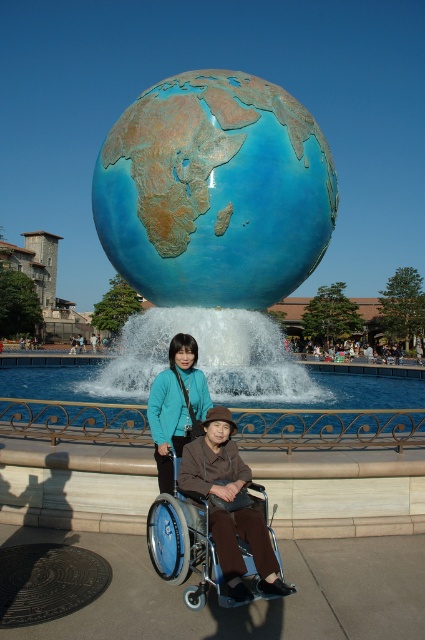
Question: Which object is positioned closest to the blue metallic wheelchair at lower center?

Choices:
 (A) blue polished globe at center
 (B) matte teal jacket at center

Answer: (B)

Question: Observing the image, what is the correct spatial positioning of blue polished globe at center in reference to matte teal jacket at center?

Choices:
 (A) below
 (B) above

Answer: (B)

Question: In this image, where is blue metallic wheelchair at lower center located relative to matte teal jacket at center?

Choices:
 (A) above
 (B) below

Answer: (B)

Question: Does blue polished globe at center have a lesser width compared to blue metallic wheelchair at lower center?

Choices:
 (A) no
 (B) yes

Answer: (A)

Question: Based on their relative distances, which object is farther from the blue metallic wheelchair at lower center?

Choices:
 (A) blue polished globe at center
 (B) matte teal jacket at center

Answer: (A)

Question: Which point is farther to the camera?

Choices:
 (A) blue metallic wheelchair at lower center
 (B) blue polished globe at center
 (C) matte teal jacket at center

Answer: (B)